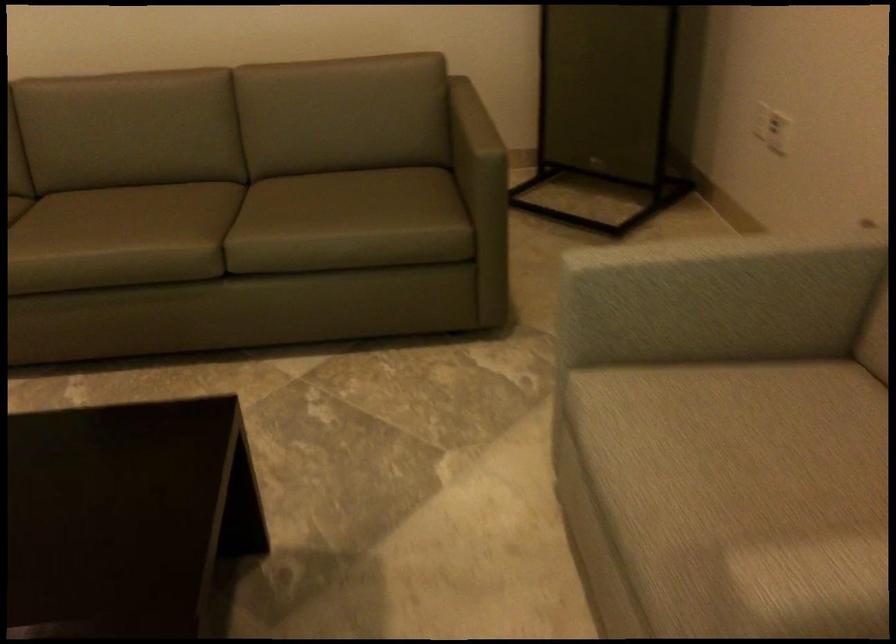
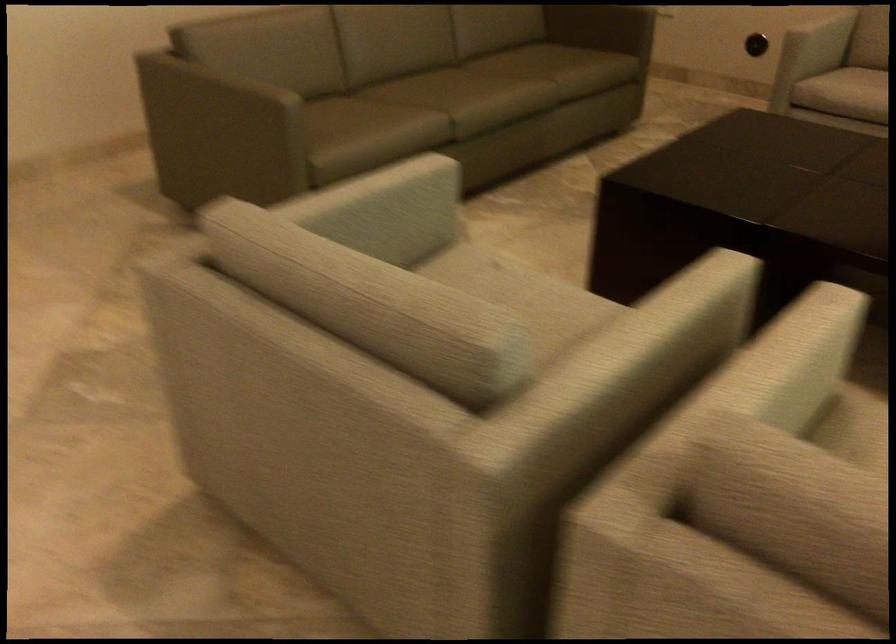
The point at (759,303) is marked in the first image. Where is the corresponding point in the second image?

(821, 35)